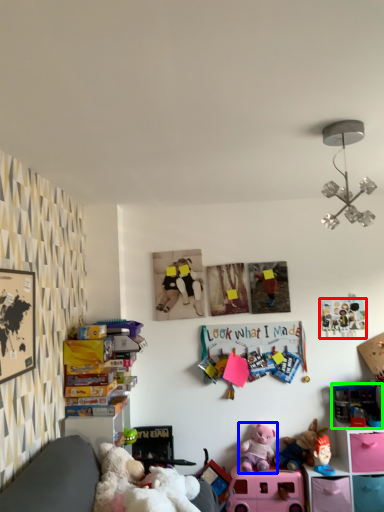
Question: Which object is the closest to the toy (highlighted by a red box)? Choose among these: toy (highlighted by a blue box) or toy (highlighted by a green box).

Choices:
 (A) toy
 (B) toy

Answer: (B)